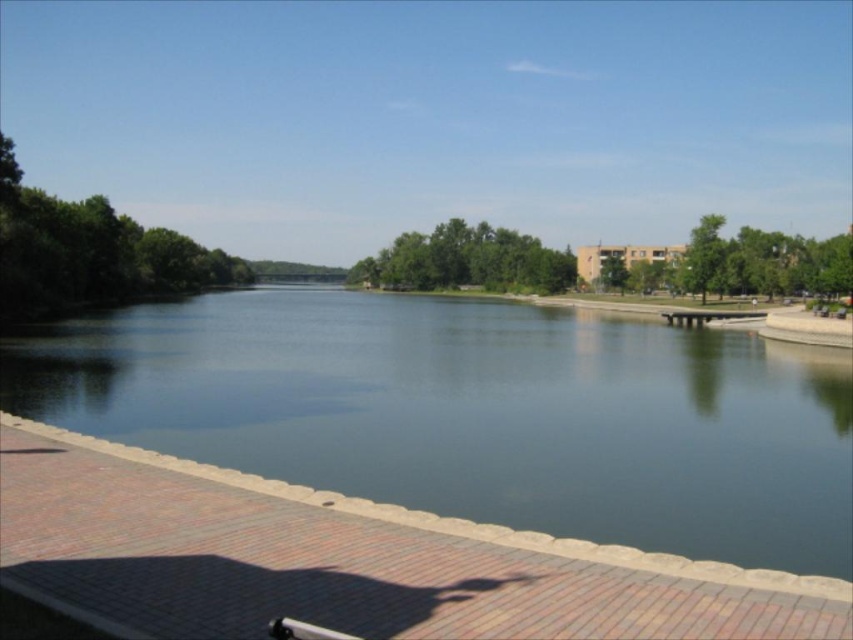
Question: Does green smooth water at center come in front of wooden park bench at center?

Choices:
 (A) no
 (B) yes

Answer: (B)

Question: Does green smooth water at center have a lesser width compared to wooden park bench at center?

Choices:
 (A) no
 (B) yes

Answer: (A)

Question: Does green smooth water at center have a lesser width compared to wooden park bench at center?

Choices:
 (A) no
 (B) yes

Answer: (A)

Question: Which point is farther to the camera?

Choices:
 (A) pos(686,314)
 (B) pos(370,413)

Answer: (A)